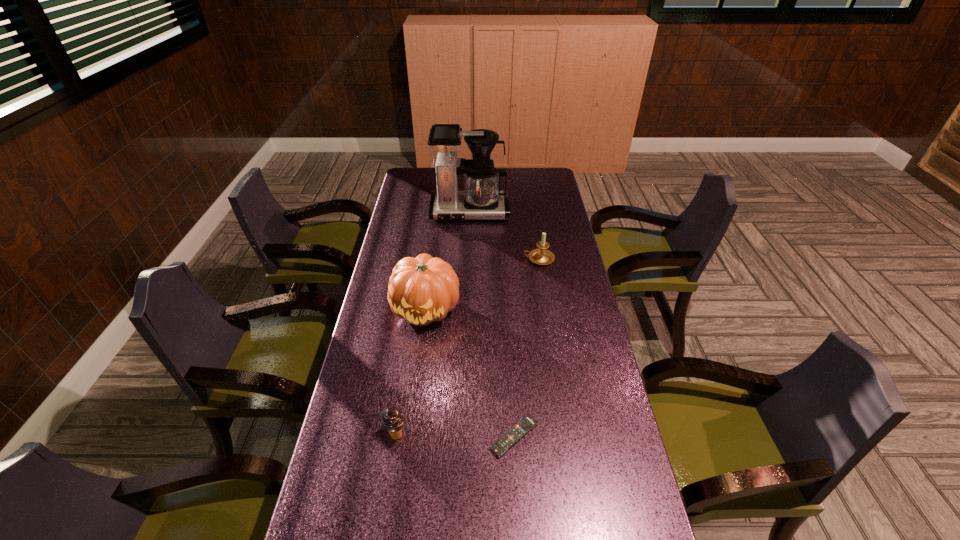
Identify the location of free spot located with a handle on the side of the rightmost object. (426, 259).

Where is `blank space located 0.370m with a handle on the side of the rightmost object`? The height and width of the screenshot is (540, 960). blank space located 0.370m with a handle on the side of the rightmost object is located at coordinates (428, 259).

Find the location of a particular element. The width and height of the screenshot is (960, 540). vacant space situated 0.250m with a handle on the side of the rightmost object is located at coordinates (459, 259).

At what (x,y) coordinates should I click in order to perform the action: click on vacant space located 0.170m on the right of the icecream. Please return your answer as a coordinate pair (x, y). Looking at the image, I should click on (472, 435).

At what (x,y) coordinates should I click in order to perform the action: click on vacant point located on the back of the shortest object. Please return your answer as a coordinate pair (x, y). Looking at the image, I should click on (511, 371).

At what (x,y) coordinates should I click in order to perform the action: click on coffee maker that is at the left edge. Please return your answer as a coordinate pair (x, y). Looking at the image, I should click on (481, 199).

Where is `pumpkin that is at the left edge`? pumpkin that is at the left edge is located at coordinates (424, 289).

What are the coordinates of `icecream positioned at the left edge` in the screenshot? It's located at pos(392,420).

Locate an element on the screen. The width and height of the screenshot is (960, 540). object at the right edge is located at coordinates (542, 256).

The height and width of the screenshot is (540, 960). In the image, there is a desktop. Identify the location of vacant space at the far edge. (508, 189).